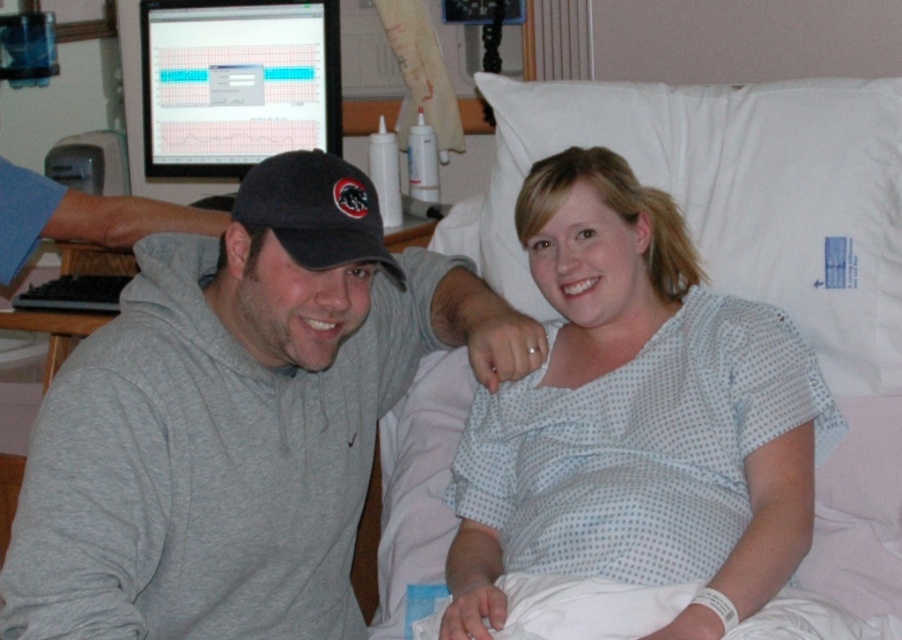
Question: Considering the real-world distances, which object is closest to the gray hoodie at center?

Choices:
 (A) black fabric baseball cap at center
 (B) white fabric pillow at upper right
 (C) white dotted hospital gown at center
 (D) matte black monitor at upper left

Answer: (A)

Question: Can you confirm if white dotted hospital gown at center is positioned to the left of white fabric pillow at upper right?

Choices:
 (A) no
 (B) yes

Answer: (B)

Question: Which object appears closest to the camera in this image?

Choices:
 (A) gray hoodie at center
 (B) black fabric baseball cap at center
 (C) white dotted hospital gown at center
 (D) matte black monitor at upper left

Answer: (A)

Question: Is matte black monitor at upper left positioned at the back of black fabric baseball cap at center?

Choices:
 (A) yes
 (B) no

Answer: (A)

Question: Can you confirm if gray hoodie at center is positioned to the right of white fabric pillow at upper right?

Choices:
 (A) yes
 (B) no

Answer: (B)

Question: Which point appears closest to the camera in this image?

Choices:
 (A) (601, 508)
 (B) (787, 161)
 (C) (299, 161)

Answer: (C)